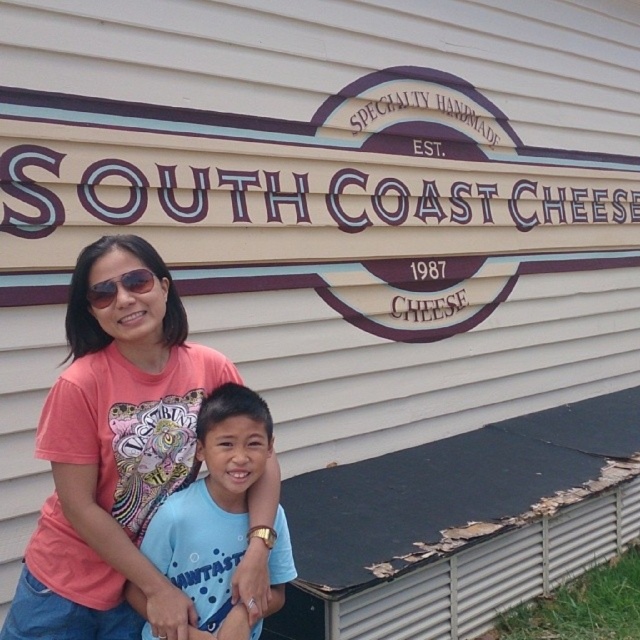
You are a photographer taking a picture of the SOUTH COAST CHEESE sign. You notice the pink fabric shirt at center and the black plastic sunglasses at upper center. Which object is closer to the bottom of the image?

The pink fabric shirt at center is located below the black plastic sunglasses at upper center, so the pink fabric shirt at center is closer to the bottom of the image.

You are trying to decide which shirt to wear for a casual day out. Both the pink fabric shirt at center and the blue cotton shirt at center are options. Based on the image, which one has a wider silhouette?

The pink fabric shirt at center might be wider than blue cotton shirt at center, so it has a wider silhouette.

You are at a store entrance and see two people wearing shirts. The pink fabric shirt at center and the blue cotton shirt at center. Which shirt is positioned to the left?

The pink fabric shirt at center is to the left of the blue cotton shirt at center.